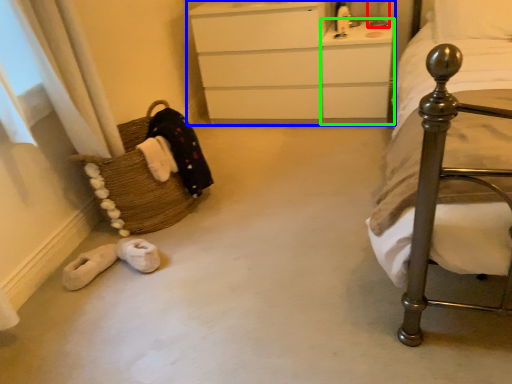
Question: Which object is the closest to the table lamp (highlighted by a red box)? Choose among these: chest of drawers (highlighted by a blue box) or vanity (highlighted by a green box).

Choices:
 (A) chest of drawers
 (B) vanity

Answer: (B)